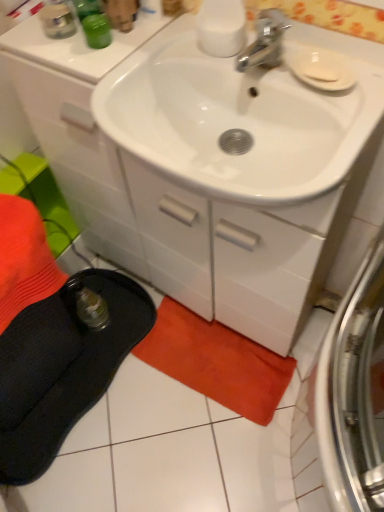
At what (x,y) coordinates should I click in order to perform the action: click on blank space situated above white glossy cabinet at center (from a real-world perspective). Please return your answer as a coordinate pair (x, y). Looking at the image, I should click on (172, 50).